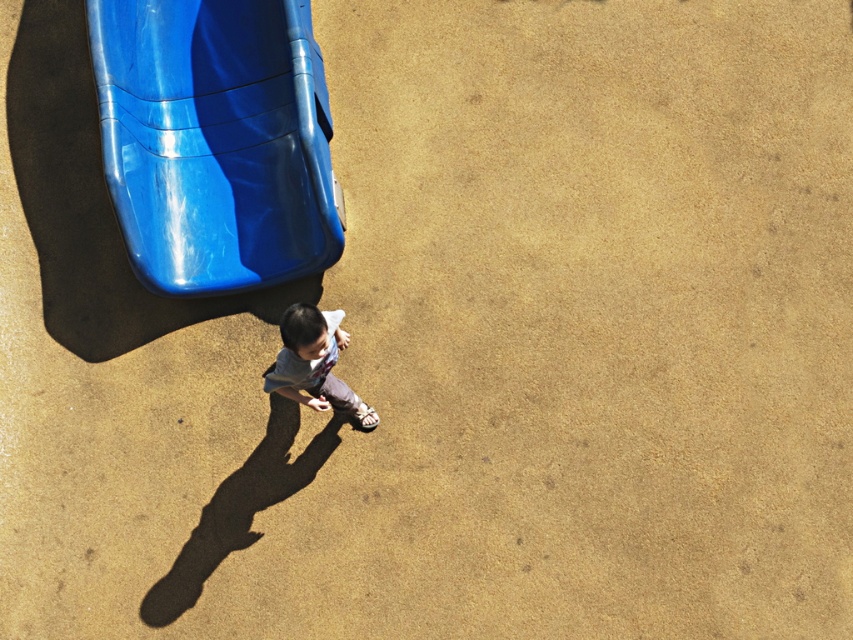
Question: Which of the following is the closest to the observer?

Choices:
 (A) (132, 232)
 (B) (337, 314)

Answer: (B)

Question: Is glossy plastic slide at upper left thinner than light gray cotton shirt at center?

Choices:
 (A) yes
 (B) no

Answer: (B)

Question: Where is glossy plastic slide at upper left located in relation to light gray cotton shirt at center in the image?

Choices:
 (A) above
 (B) below

Answer: (A)

Question: Which of the following is the closest to the observer?

Choices:
 (A) (332, 332)
 (B) (300, 186)

Answer: (A)

Question: Can you confirm if glossy plastic slide at upper left is positioned to the left of light gray cotton shirt at center?

Choices:
 (A) no
 (B) yes

Answer: (B)